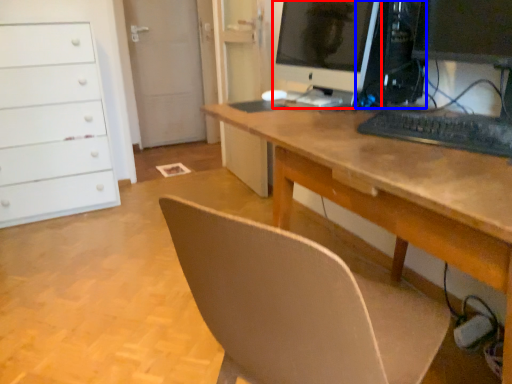
Question: Which of the following is the farthest to the observer, computer monitor (highlighted by a red box) or desktop computer (highlighted by a blue box)?

Choices:
 (A) computer monitor
 (B) desktop computer

Answer: (B)